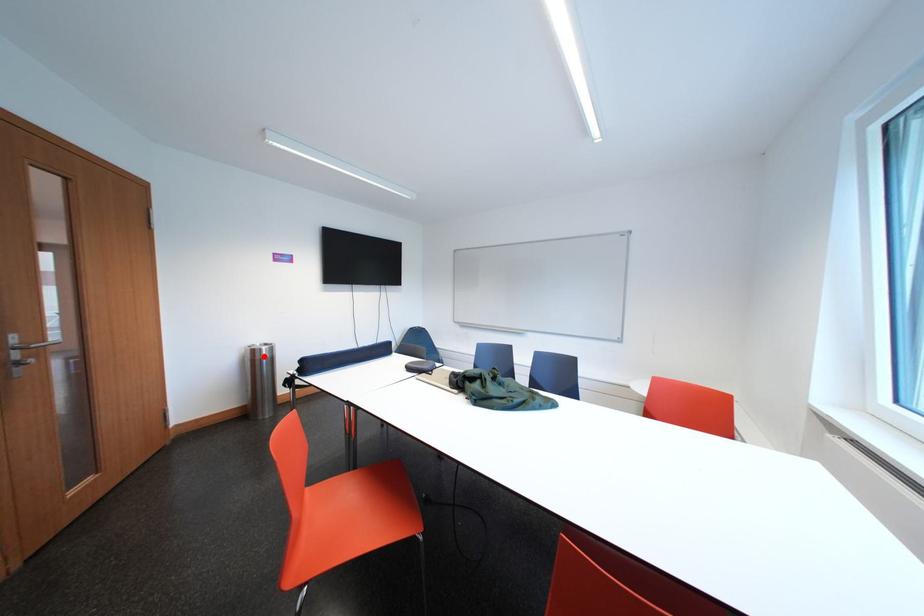
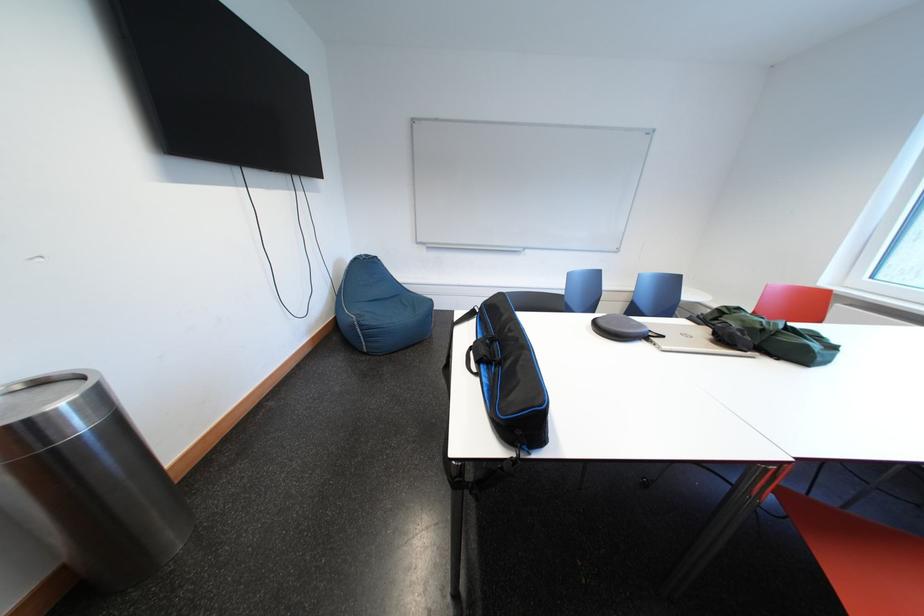
Find the pixel in the second image that matches the highlighted location in the first image.

(30, 439)